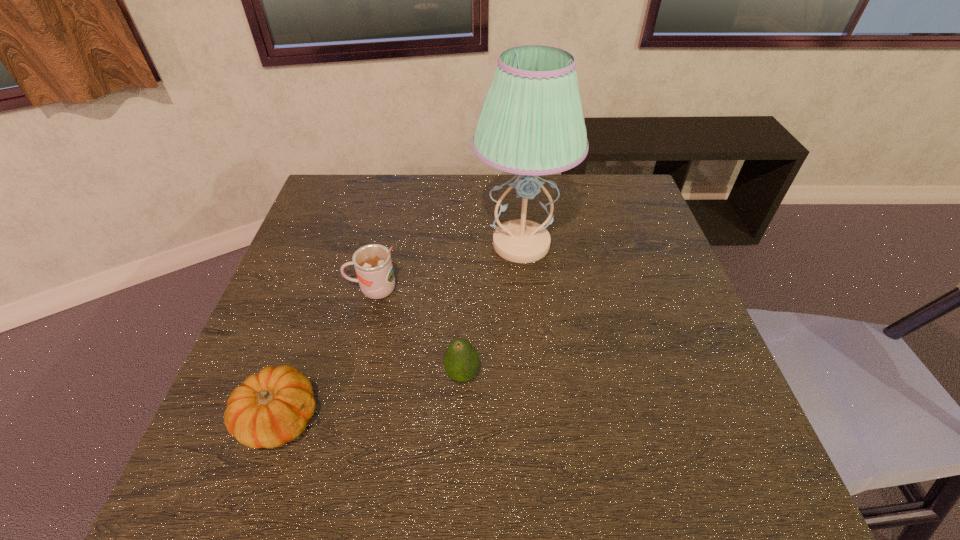
In order to click on vacant space that satisfies the following two spatial constraints: 1. on the side with the handle of the third shortest object; 2. on the right side of the avocado in this screenshot , I will do `click(353, 375)`.

Where is `free point that satisfies the following two spatial constraints: 1. on the side with the handle of the avocado; 2. on the right side of the cup`? Image resolution: width=960 pixels, height=540 pixels. free point that satisfies the following two spatial constraints: 1. on the side with the handle of the avocado; 2. on the right side of the cup is located at coordinates coord(353,375).